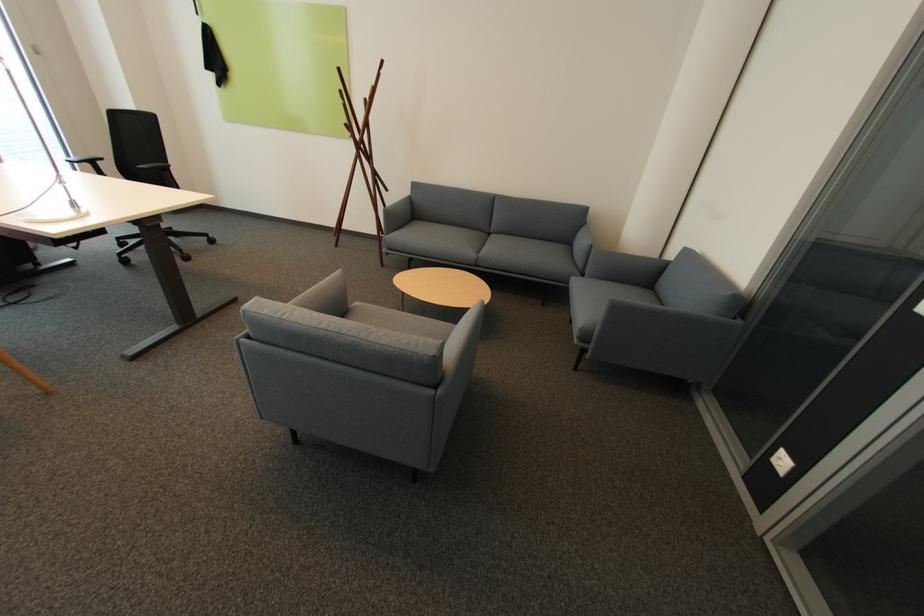
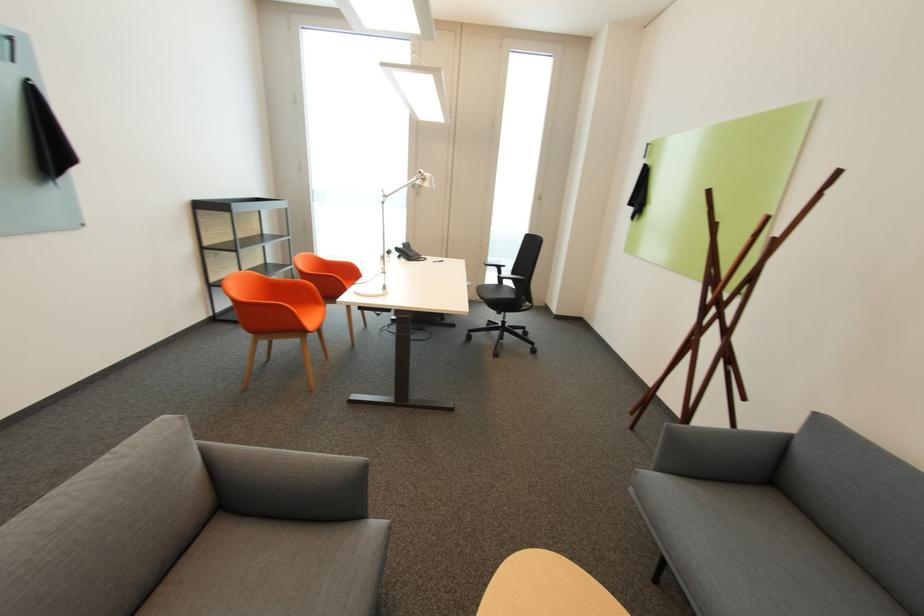
The point at (341, 236) is marked in the first image. Where is the corresponding point in the second image?

(638, 414)